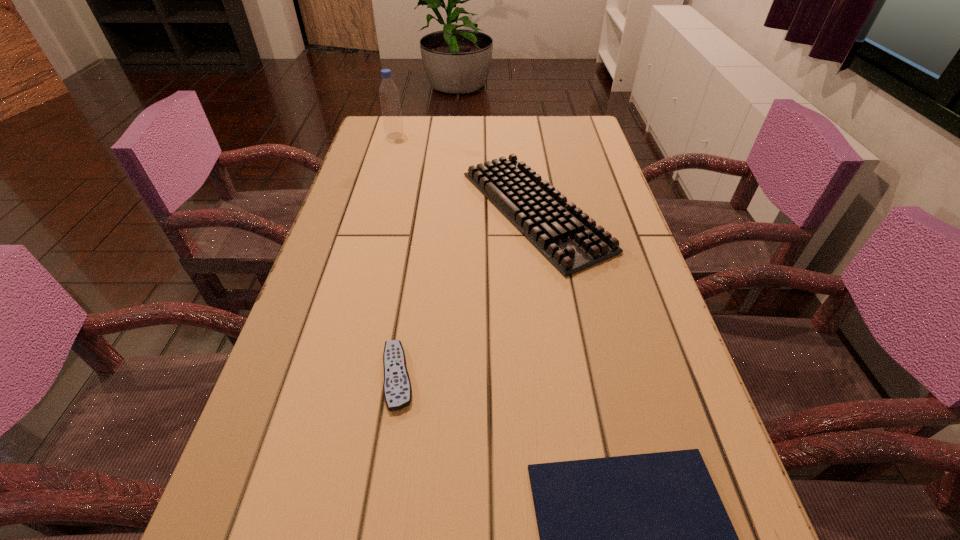
Identify which object is the nearest to the shortest object. Please provide its 2D coordinates. Your answer should be formatted as a tuple, i.e. [(x, y)], where the tuple contains the x and y coordinates of a point satisfying the conditions above.

[(397, 390)]

The width and height of the screenshot is (960, 540). I want to click on vacant space that satisfies the following two spatial constraints: 1. on the back side of the remote control; 2. on the right side of the second tallest object, so click(422, 211).